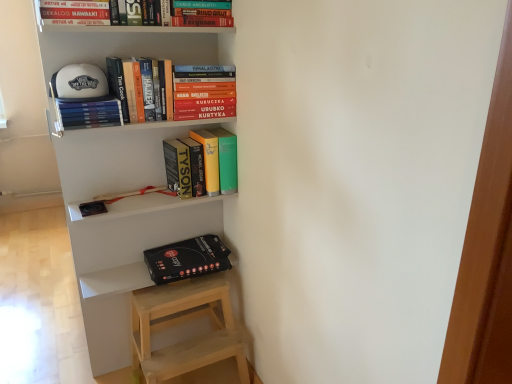
Question: Looking at their shapes, would you say hardcover book at upper center, the first book in the top-to-bottom sequence, is wider or thinner than hardcover books at upper left, which is counted as the second book, starting from the bottom?

Choices:
 (A) thin
 (B) wide

Answer: (A)

Question: Considering the positions of hardcover book at upper center, which is the 5th book in bottom-to-top order, and hardcover books at upper left, which is counted as the second book, starting from the bottom, in the image, is hardcover book at upper center, which is the 5th book in bottom-to-top order, bigger or smaller than hardcover books at upper left, which is counted as the second book, starting from the bottom,?

Choices:
 (A) small
 (B) big

Answer: (B)

Question: Estimate the real-world distances between objects in this image. Which object is farther from the black matte box at lower left?

Choices:
 (A) hardcover books at upper left, which is the fourth book from bottom to top
 (B) matte yellow book at center, the 1th book from the bottom
 (C) hardcover books at upper center, which appears as the third book when ordered from the bottom
 (D) hardcover books at upper left, which is counted as the second book, starting from the bottom
 (E) white matte bookshelf at upper center

Answer: (D)

Question: Estimate the real-world distances between objects in this image. Which object is farther from the white matte bookshelf at upper center?

Choices:
 (A) hardcover books at upper left, arranged as the 2th book when viewed from the top
 (B) hardcover book at upper center, which is the 5th book in bottom-to-top order
 (C) black matte box at lower left
 (D) hardcover books at upper left, which is counted as the second book, starting from the bottom
 (E) matte yellow book at center, the 1th book from the bottom

Answer: (B)